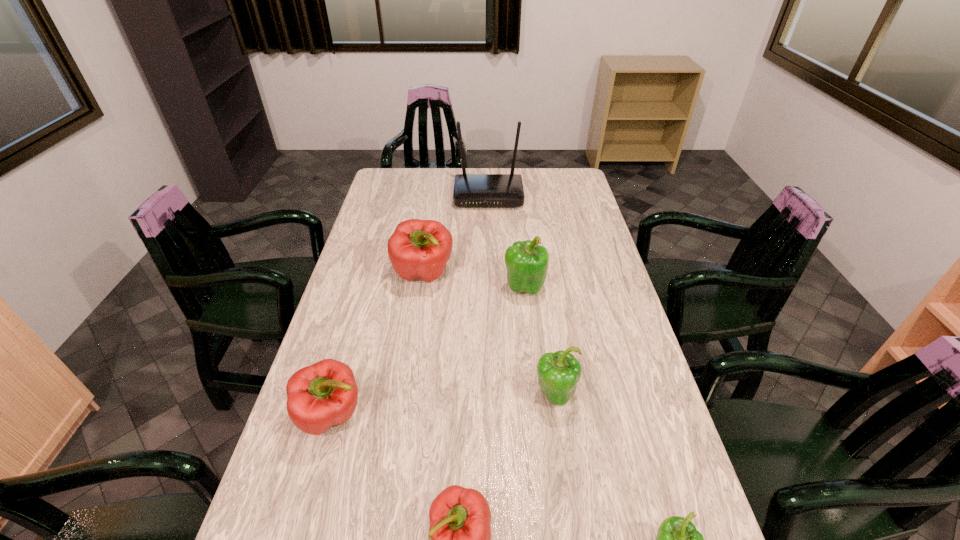
Locate an element on the screen. This screenshot has height=540, width=960. the farthest object is located at coordinates (470, 190).

Image resolution: width=960 pixels, height=540 pixels. In order to click on router in this screenshot , I will do `click(470, 190)`.

I want to click on the farthest green bell pepper, so click(x=526, y=262).

Where is `the biggest pink bell pepper`? This screenshot has width=960, height=540. the biggest pink bell pepper is located at coordinates (418, 249).

Where is `the second smallest green bell pepper`? Image resolution: width=960 pixels, height=540 pixels. the second smallest green bell pepper is located at coordinates (558, 373).

You are a GUI agent. You are given a task and a screenshot of the screen. Output one action in this format:
    pyautogui.click(x=<x>, y=<y>)
    Task: Click on the second biggest pink bell pepper
    The height and width of the screenshot is (540, 960).
    Given the screenshot: What is the action you would take?
    pyautogui.click(x=324, y=394)

Where is `free space located 0.350m on the front-facing side of the tallest object`? free space located 0.350m on the front-facing side of the tallest object is located at coordinates (491, 265).

Locate an element on the screen. blank area located on the back of the biggest green bell pepper is located at coordinates (521, 265).

Locate an element on the screen. The image size is (960, 540). vacant region located 0.150m on the front of the biggest pink bell pepper is located at coordinates (416, 328).

This screenshot has width=960, height=540. I want to click on free location located on the right of the second farthest green bell pepper, so click(x=650, y=395).